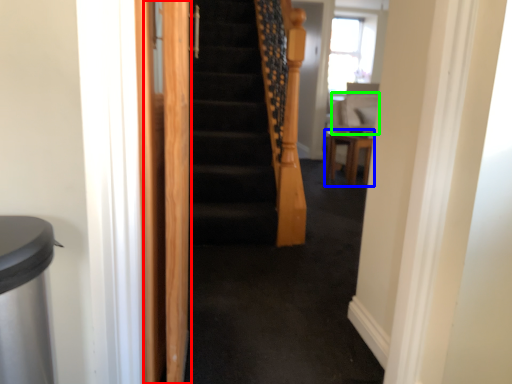
Question: Based on their relative distances, which object is farther from screen door (highlighted by a red box)? Choose from furniture (highlighted by a blue box) and sit (highlighted by a green box).

Choices:
 (A) furniture
 (B) sit

Answer: (B)